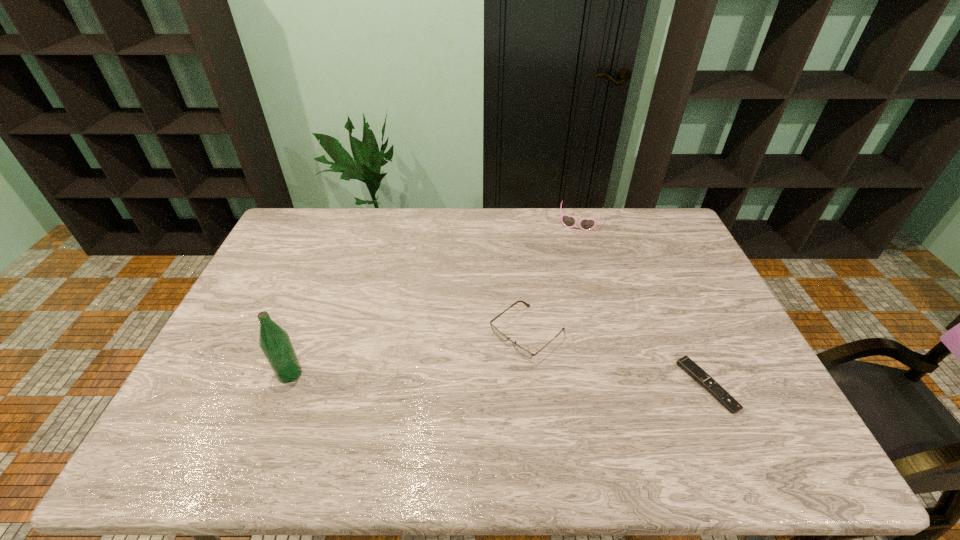
Image resolution: width=960 pixels, height=540 pixels. In order to click on vacant spot on the desktop that is between the tallest object and the shortest object and is positioned on the front-facing side of the farthest object in this screenshot , I will do `click(538, 381)`.

Image resolution: width=960 pixels, height=540 pixels. Find the location of `free space on the desktop that is between the bottle and the shortest object and is positioned on the front-facing side of the spectacles`. free space on the desktop that is between the bottle and the shortest object and is positioned on the front-facing side of the spectacles is located at coordinates (472, 379).